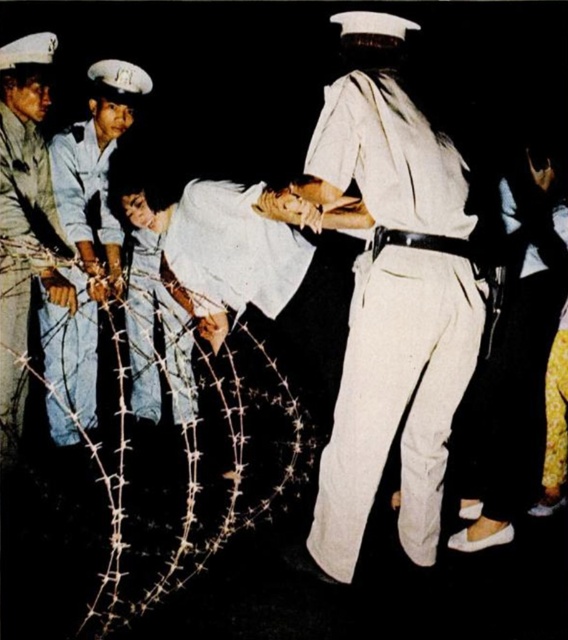
Question: Which object is closer to the camera taking this photo?

Choices:
 (A) jeans at left
 (B) black leather belt at center
 (C) white cotton uniform at center
 (D) blue denim jeans at left

Answer: (C)

Question: Does blue denim jeans at left have a lesser width compared to jeans at left?

Choices:
 (A) no
 (B) yes

Answer: (A)

Question: Which point is closer to the camera taking this photo?

Choices:
 (A) (22, 83)
 (B) (97, 365)
 (C) (340, 193)
 (D) (398, 234)

Answer: (C)

Question: Can you confirm if jeans at left is thinner than black leather belt at center?

Choices:
 (A) yes
 (B) no

Answer: (B)

Question: Is the position of white cotton uniform at center less distant than that of black leather belt at center?

Choices:
 (A) no
 (B) yes

Answer: (B)

Question: Which point appears closest to the camera in this image?

Choices:
 (A) (314, 177)
 (B) (375, 237)
 (C) (24, 67)
 (D) (85, 337)

Answer: (A)